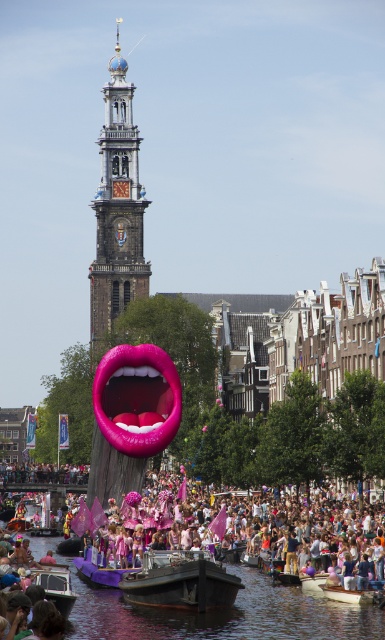
Question: Can you confirm if gold ornate clock tower at center is bigger than metallic silver boat at lower left?

Choices:
 (A) yes
 (B) no

Answer: (A)

Question: Which object is positioned farthest from the metallic silver boat at lower left?

Choices:
 (A) metallic silver boat at center
 (B) purple fabric boat at center
 (C) gold ornate clock tower at center

Answer: (C)

Question: Does dark gray metal boat at center appear under wooden boat at lower center?

Choices:
 (A) no
 (B) yes

Answer: (A)

Question: Does dark water at center have a smaller size compared to dark gray metal boat at center?

Choices:
 (A) no
 (B) yes

Answer: (A)

Question: Which object is closer to the camera taking this photo?

Choices:
 (A) gold ornate clock tower at center
 (B) wooden boat at lower center
 (C) metallic silver boat at center
 (D) purple fabric boat at center

Answer: (B)

Question: Which object is positioned farthest from the purple fabric boat at center?

Choices:
 (A) dark gray metal boat at center
 (B) wooden boat at lower center
 (C) metallic silver boat at lower left

Answer: (B)